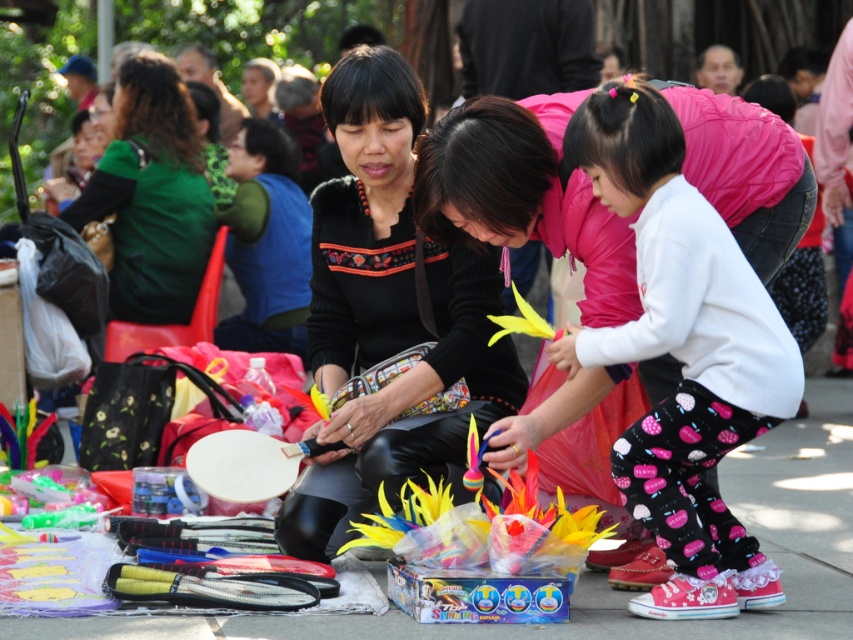
You are a delivery person who needs to place a small package between the white fleece sweater at center and the black leather jacket at center. The package is 1.5 meters long. Will it fit between them?

The distance between the white fleece sweater at center and the black leather jacket at center is 1.28 meters, which is shorter than the 1.5 meters length of the package. Therefore, the package will not fit between them.

You are a delivery person who needs to place a package on the smooth concrete pavement at center. However, there is a black leather jacket at center in the way. Can you move the jacket to access the pavement?

The smooth concrete pavement at center is behind the black leather jacket at center, so you can move the jacket to access the pavement.